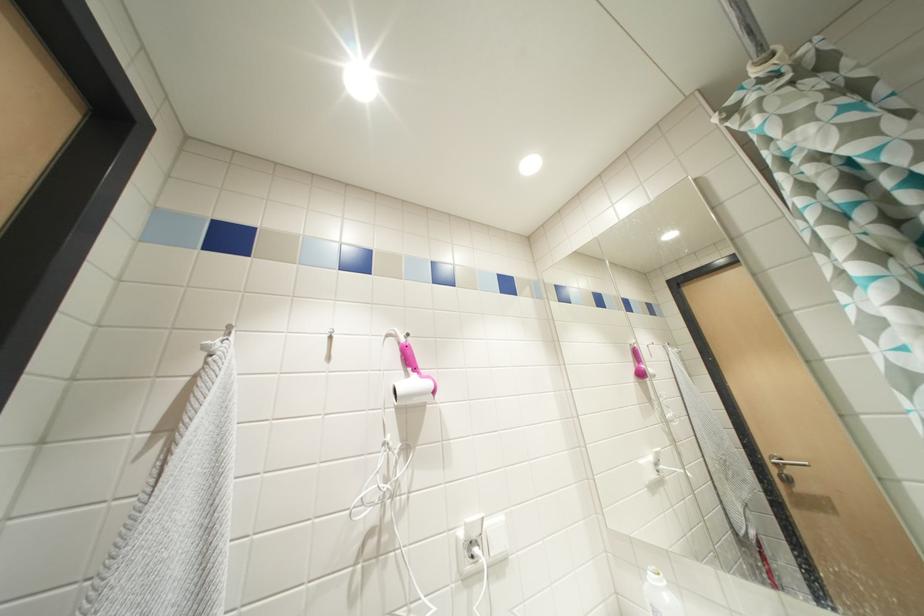
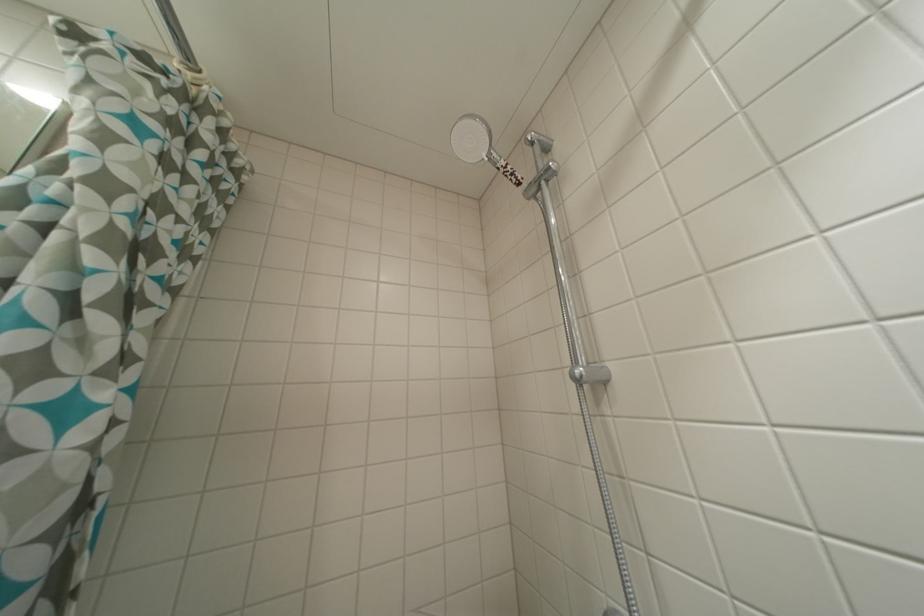
The first image is from the beginning of the video and the second image is from the end. How did the camera likely rotate when shooting the video?

The rotation direction of the camera is right-up.